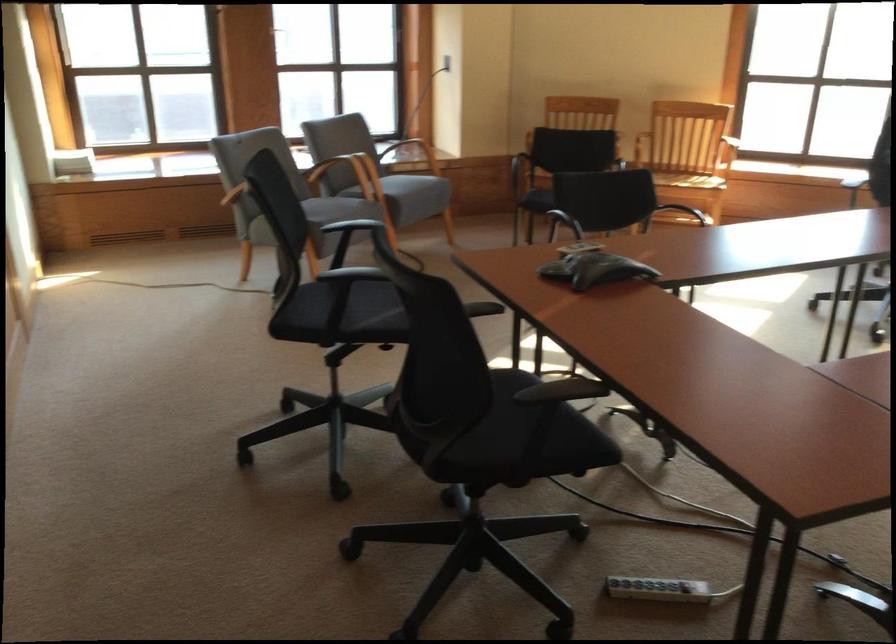
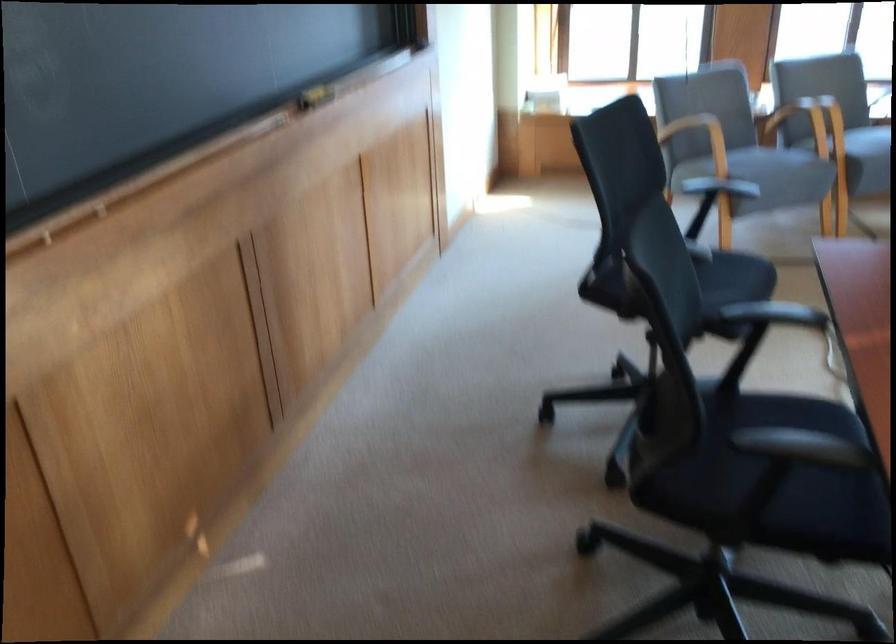
Where in the second image is the point corresponding to point (382, 301) from the first image?

(717, 285)